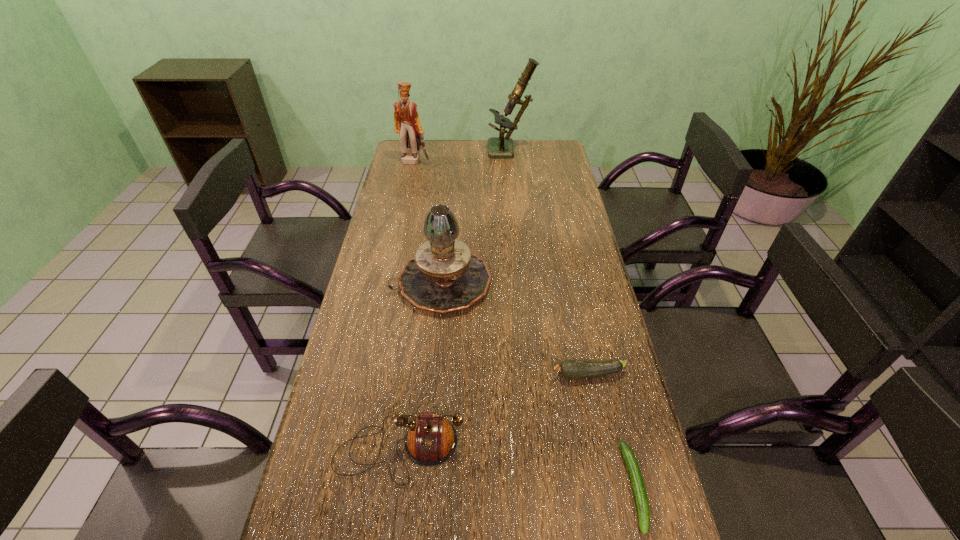
Locate an element on the screen. microscope is located at coordinates (498, 147).

The image size is (960, 540). Identify the location of nutcracker. (407, 124).

I want to click on oil lamp, so click(444, 276).

At what (x,y) coordinates should I click in order to perform the action: click on the third tallest object. Please return your answer as a coordinate pair (x, y). The height and width of the screenshot is (540, 960). Looking at the image, I should click on (444, 276).

Where is `the third shortest object`? The width and height of the screenshot is (960, 540). the third shortest object is located at coordinates (431, 440).

Find the location of a particular element. The height and width of the screenshot is (540, 960). the farther zucchini is located at coordinates (571, 369).

The image size is (960, 540). I want to click on the fourth farthest object, so click(x=571, y=369).

Find the location of a particular element. The width and height of the screenshot is (960, 540). the shorter zucchini is located at coordinates (639, 490).

At what (x,y) coordinates should I click in order to perform the action: click on the nearer zucchini. Please return your answer as a coordinate pair (x, y). The width and height of the screenshot is (960, 540). Looking at the image, I should click on (639, 490).

This screenshot has width=960, height=540. In order to click on vacant space located 0.180m at the eyepiece of the microscope in this screenshot , I will do `click(447, 152)`.